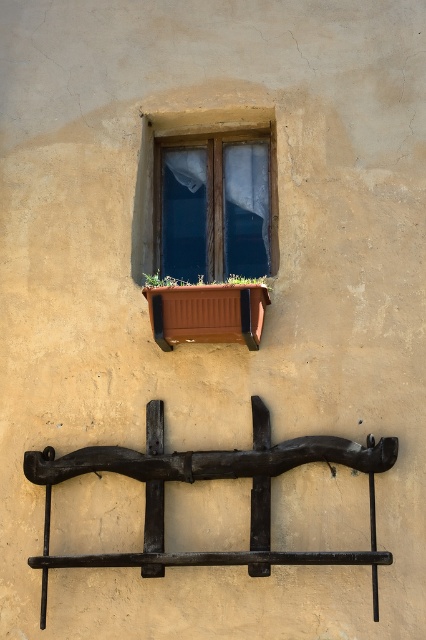
Image resolution: width=426 pixels, height=640 pixels. Describe the element at coordinates (210, 477) in the screenshot. I see `black metal rail at center` at that location.

From the picture: Is black metal rail at center smaller than brown wooden planter at center?

No.

Where is `black metal rail at center`? The height and width of the screenshot is (640, 426). black metal rail at center is located at coordinates (210, 477).

Image resolution: width=426 pixels, height=640 pixels. What do you see at coordinates (213, 205) in the screenshot? I see `wooden window at upper center` at bounding box center [213, 205].

Can you confirm if wooden window at upper center is positioned to the right of green leafy plant at center?

Yes, wooden window at upper center is to the right of green leafy plant at center.

Does point (204, 172) lie behind point (252, 280)?

Yes, point (204, 172) is farther from viewer.

Where is `wooden window at upper center`? wooden window at upper center is located at coordinates (213, 205).

Is black metal rail at center thinner than green leafy plant at center?

In fact, black metal rail at center might be wider than green leafy plant at center.

Does black metal rail at center appear on the left side of green leafy plant at center?

Incorrect, black metal rail at center is not on the left side of green leafy plant at center.

Does point (256, 474) lie behind point (170, 280)?

No, it is not.

The height and width of the screenshot is (640, 426). What are the coordinates of `black metal rail at center` in the screenshot? It's located at (210, 477).